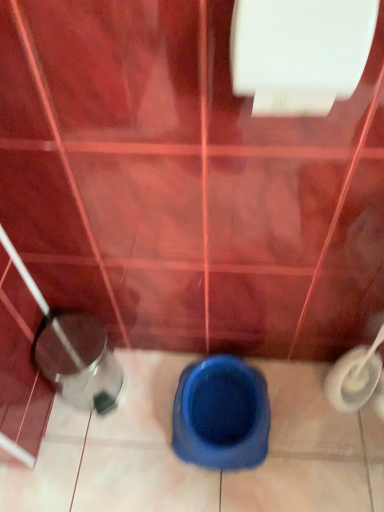
Question: Is the depth of white glossy toilet paper at upper center greater than that of blue rubber toilet at center?

Choices:
 (A) no
 (B) yes

Answer: (A)

Question: Would you say white glossy toilet paper at upper center is a long distance from blue rubber toilet at center?

Choices:
 (A) no
 (B) yes

Answer: (A)

Question: Considering the relative positions of white glossy toilet paper at upper center and blue rubber toilet at center in the image provided, is white glossy toilet paper at upper center to the left of blue rubber toilet at center from the viewer's perspective?

Choices:
 (A) no
 (B) yes

Answer: (A)

Question: Is blue rubber toilet at center inside white glossy toilet paper at upper center?

Choices:
 (A) yes
 (B) no

Answer: (B)

Question: From a real-world perspective, is white glossy toilet paper at upper center on top of blue rubber toilet at center?

Choices:
 (A) yes
 (B) no

Answer: (A)

Question: Is blue rubber toilet at center to the left or to the right of shiny metallic potty at lower left in the image?

Choices:
 (A) right
 (B) left

Answer: (A)

Question: Is blue rubber toilet at center in front of or behind shiny metallic potty at lower left in the image?

Choices:
 (A) behind
 (B) front

Answer: (B)

Question: In terms of height, does blue rubber toilet at center look taller or shorter compared to shiny metallic potty at lower left?

Choices:
 (A) short
 (B) tall

Answer: (A)

Question: Is blue rubber toilet at center wider or thinner than shiny metallic potty at lower left?

Choices:
 (A) thin
 (B) wide

Answer: (B)

Question: Which is correct: shiny metallic potty at lower left is inside white glossy toilet paper at upper center, or outside of it?

Choices:
 (A) outside
 (B) inside

Answer: (A)

Question: Relative to white glossy toilet paper at upper center, is shiny metallic potty at lower left in front or behind?

Choices:
 (A) front
 (B) behind

Answer: (B)

Question: In terms of height, does shiny metallic potty at lower left look taller or shorter compared to white glossy toilet paper at upper center?

Choices:
 (A) short
 (B) tall

Answer: (B)

Question: Looking at their shapes, would you say shiny metallic potty at lower left is wider or thinner than white glossy toilet paper at upper center?

Choices:
 (A) wide
 (B) thin

Answer: (A)

Question: From the image's perspective, is white glossy toilet paper at upper center located above or below shiny metallic potty at lower left?

Choices:
 (A) above
 (B) below

Answer: (A)

Question: From a real-world perspective, is white glossy toilet paper at upper center above or below shiny metallic potty at lower left?

Choices:
 (A) below
 (B) above

Answer: (B)